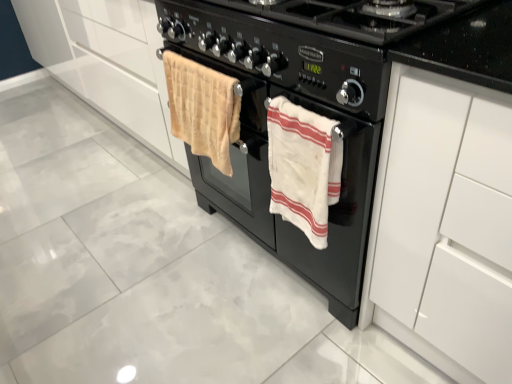
Question: Is white cotton towel at center, acting as the 1th beach towel starting from the right, not within black matte gas stove at center?

Choices:
 (A) yes
 (B) no

Answer: (A)

Question: Is white cotton towel at center, the second beach towel from the left, in front of black matte gas stove at center?

Choices:
 (A) no
 (B) yes

Answer: (A)

Question: From a real-world perspective, is white cotton towel at center, the second beach towel from the left, located beneath black matte gas stove at center?

Choices:
 (A) no
 (B) yes

Answer: (B)

Question: Does white cotton towel at center, the second beach towel from the left, appear on the right side of black matte gas stove at center?

Choices:
 (A) no
 (B) yes

Answer: (A)

Question: Is white cotton towel at center, the second beach towel from the left, wider than black matte gas stove at center?

Choices:
 (A) no
 (B) yes

Answer: (A)

Question: Is white glossy cabinet at right taller or shorter than white cotton towel at center, the second beach towel from the left?

Choices:
 (A) short
 (B) tall

Answer: (B)

Question: From a real-world perspective, is white glossy cabinet at right positioned above or below white cotton towel at center, acting as the 1th beach towel starting from the right?

Choices:
 (A) above
 (B) below

Answer: (B)

Question: From the image's perspective, is white glossy cabinet at right located above or below white cotton towel at center, the second beach towel from the left?

Choices:
 (A) above
 (B) below

Answer: (B)

Question: Is white glossy cabinet at right in front of or behind white cotton towel at center, acting as the 1th beach towel starting from the right, in the image?

Choices:
 (A) front
 (B) behind

Answer: (A)

Question: Is black matte gas stove at center inside the boundaries of white cotton towel at center, acting as the 1th beach towel starting from the right, or outside?

Choices:
 (A) inside
 (B) outside

Answer: (B)

Question: Does point (327, 57) appear closer or farther from the camera than point (279, 114)?

Choices:
 (A) closer
 (B) farther

Answer: (A)

Question: From the image's perspective, is black matte gas stove at center above or below white cotton towel at center, the second beach towel from the left?

Choices:
 (A) below
 (B) above

Answer: (B)

Question: Looking at the image, does black matte gas stove at center seem bigger or smaller compared to white cotton towel at center, acting as the 1th beach towel starting from the right?

Choices:
 (A) small
 (B) big

Answer: (B)

Question: Looking at their shapes, would you say beige plush towel at center, the 2th beach towel viewed from the right, is wider or thinner than black matte gas stove at center?

Choices:
 (A) wide
 (B) thin

Answer: (B)

Question: Choose the correct answer: Is beige plush towel at center, acting as the 1th beach towel starting from the left, inside black matte gas stove at center or outside it?

Choices:
 (A) inside
 (B) outside

Answer: (B)